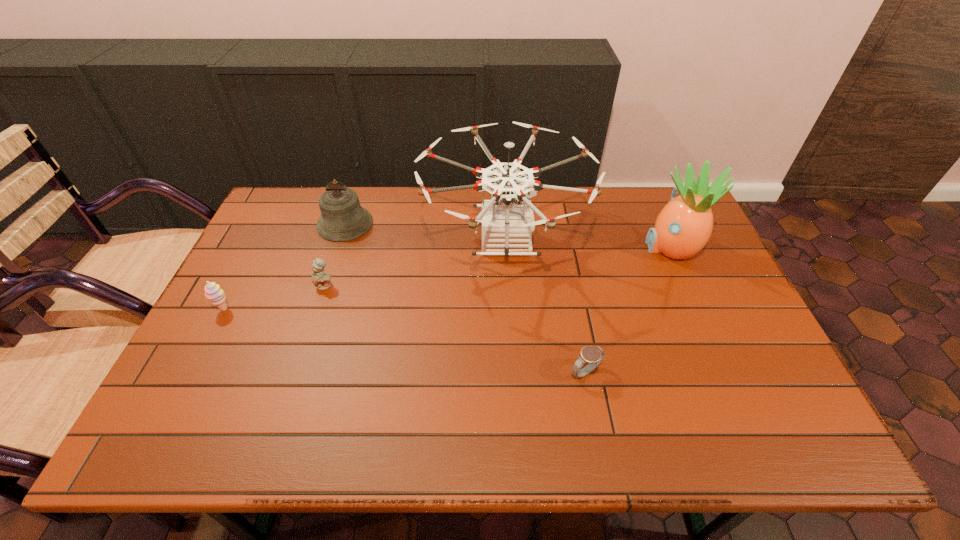
Find the location of `drone`. drone is located at coordinates (507, 219).

Where is `the rightmost object`? The image size is (960, 540). the rightmost object is located at coordinates click(682, 229).

Image resolution: width=960 pixels, height=540 pixels. Find the location of `the second tallest object`. the second tallest object is located at coordinates (682, 229).

At what (x,y) coordinates should I click in order to perform the action: click on bell. Please return your answer as a coordinate pair (x, y). This screenshot has width=960, height=540. Looking at the image, I should click on (342, 218).

Locate an element on the screen. The height and width of the screenshot is (540, 960). the leftmost object is located at coordinates (213, 292).

Identify the location of teddy bear. The height and width of the screenshot is (540, 960). (321, 279).

Where is `the shortest object`? the shortest object is located at coordinates (593, 355).

Locate an element on the screen. watch is located at coordinates (593, 355).

I want to click on free space located on the front of the tallest object, so click(x=514, y=408).

Where is `free space located 0.050m at the entrance of the rightmost object`? This screenshot has height=540, width=960. free space located 0.050m at the entrance of the rightmost object is located at coordinates (626, 247).